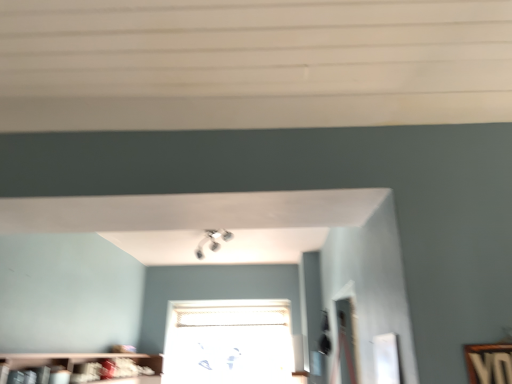
Question: Considering the positions of point [x=173, y=365] and point [x=160, y=359], is point [x=173, y=365] closer or farther from the camera than point [x=160, y=359]?

Choices:
 (A) closer
 (B) farther

Answer: (B)

Question: Which is correct: transparent glass window at center is inside wooden bookshelf at lower left, or outside of it?

Choices:
 (A) inside
 (B) outside

Answer: (B)

Question: From the image's perspective, relative to wooden bookshelf at lower left, is transparent glass window at center above or below?

Choices:
 (A) below
 (B) above

Answer: (A)

Question: Is wooden bookshelf at lower left in front of or behind transparent glass window at center in the image?

Choices:
 (A) behind
 (B) front

Answer: (B)

Question: From the image's perspective, is wooden bookshelf at lower left located above or below transparent glass window at center?

Choices:
 (A) above
 (B) below

Answer: (A)

Question: Is wooden bookshelf at lower left bigger or smaller than transparent glass window at center?

Choices:
 (A) small
 (B) big

Answer: (B)

Question: Is wooden bookshelf at lower left to the left or to the right of transparent glass window at center in the image?

Choices:
 (A) right
 (B) left

Answer: (B)